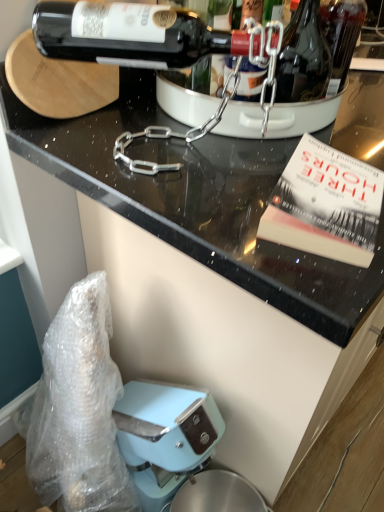
Question: Is hardcover book at upper right behind shiny dark glass bottle at upper right?

Choices:
 (A) no
 (B) yes

Answer: (A)

Question: Is hardcover book at upper right bigger than shiny dark glass bottle at upper right?

Choices:
 (A) yes
 (B) no

Answer: (B)

Question: From a real-world perspective, is hardcover book at upper right below shiny dark glass bottle at upper right?

Choices:
 (A) yes
 (B) no

Answer: (A)

Question: Would you say hardcover book at upper right contains shiny dark glass bottle at upper right?

Choices:
 (A) yes
 (B) no

Answer: (B)

Question: Does hardcover book at upper right turn towards shiny dark glass bottle at upper right?

Choices:
 (A) yes
 (B) no

Answer: (B)

Question: Do you think black glossy countertop at upper center is within hardcover book at upper right, or outside of it?

Choices:
 (A) outside
 (B) inside

Answer: (A)

Question: From the image's perspective, is black glossy countertop at upper center located above or below hardcover book at upper right?

Choices:
 (A) above
 (B) below

Answer: (A)

Question: Does point (193, 251) appear closer or farther from the camera than point (317, 181)?

Choices:
 (A) closer
 (B) farther

Answer: (A)

Question: In terms of width, does black glossy countertop at upper center look wider or thinner when compared to hardcover book at upper right?

Choices:
 (A) thin
 (B) wide

Answer: (B)

Question: Based on their sizes in the image, would you say black glossy countertop at upper center is bigger or smaller than shiny dark glass bottle at upper right?

Choices:
 (A) small
 (B) big

Answer: (B)

Question: From the image's perspective, relative to shiny dark glass bottle at upper right, is black glossy countertop at upper center above or below?

Choices:
 (A) above
 (B) below

Answer: (B)

Question: Looking at their shapes, would you say black glossy countertop at upper center is wider or thinner than shiny dark glass bottle at upper right?

Choices:
 (A) wide
 (B) thin

Answer: (A)

Question: Considering their positions, is black glossy countertop at upper center located in front of or behind shiny dark glass bottle at upper right?

Choices:
 (A) front
 (B) behind

Answer: (A)

Question: Which is correct: shiny dark glass bottle at upper center is inside hardcover book at upper right, or outside of it?

Choices:
 (A) outside
 (B) inside

Answer: (A)

Question: From the image's perspective, relative to hardcover book at upper right, is shiny dark glass bottle at upper center above or below?

Choices:
 (A) below
 (B) above

Answer: (B)